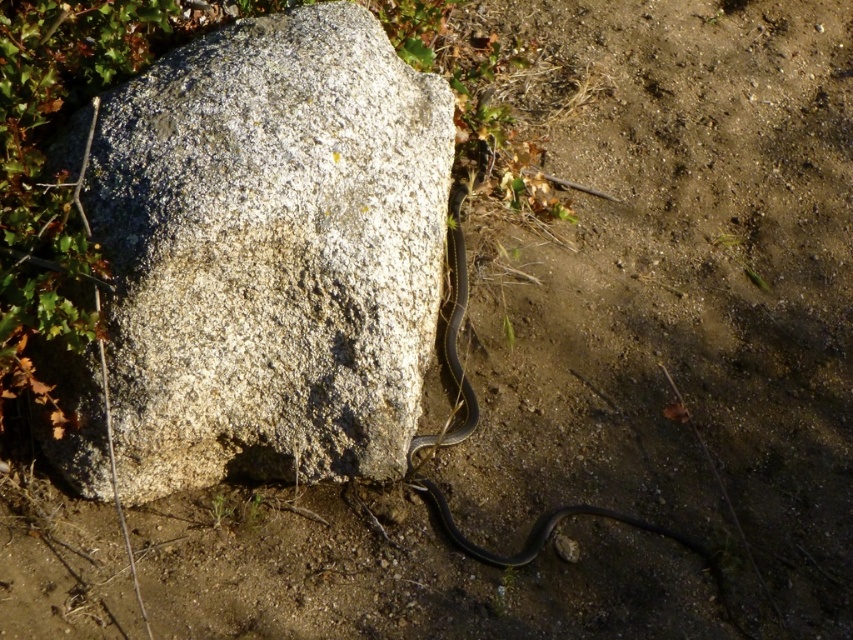
Question: Which point appears closest to the camera in this image?

Choices:
 (A) (457, 205)
 (B) (389, 100)

Answer: (B)

Question: Is granite rock at center bigger than black glossy snake at center?

Choices:
 (A) no
 (B) yes

Answer: (B)

Question: Does granite rock at center have a greater width compared to black glossy snake at center?

Choices:
 (A) no
 (B) yes

Answer: (B)

Question: Does granite rock at center have a lesser width compared to black glossy snake at center?

Choices:
 (A) yes
 (B) no

Answer: (B)